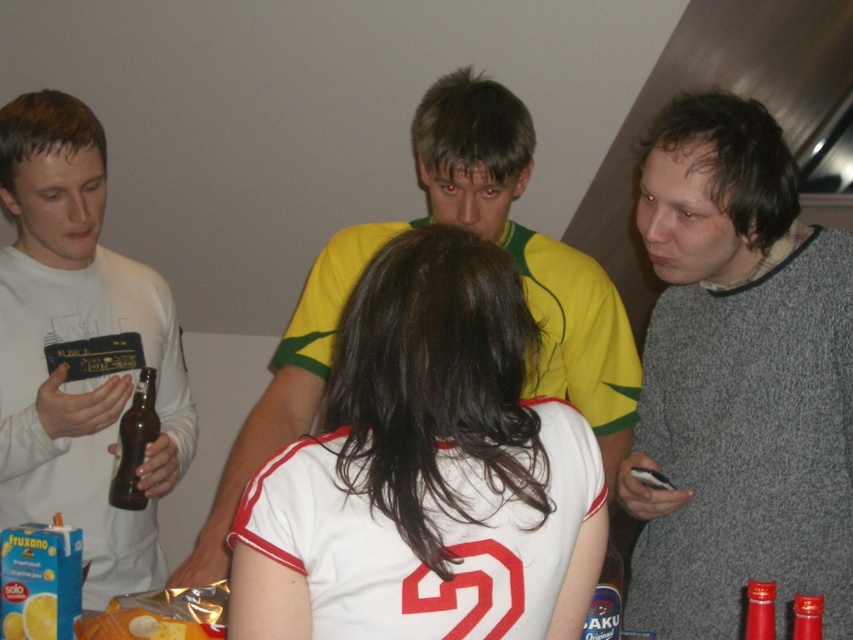
Question: Which of the following is the farthest from the observer?

Choices:
 (A) gray wool sweater at right
 (B) brown glass bottle at center

Answer: (B)

Question: Can you confirm if gray wool sweater at right is bigger than metallic silver bottle at lower right?

Choices:
 (A) no
 (B) yes

Answer: (B)

Question: Considering the real-world distances, which object is farthest from the red glass bottle at lower right?

Choices:
 (A) white matte shirt at left
 (B) gray wool sweater at right
 (C) brown glass bottle at center

Answer: (A)

Question: Can you confirm if brown glass bottle at center is smaller than translucent plastic bottle at lower right?

Choices:
 (A) yes
 (B) no

Answer: (A)

Question: Which of these objects is positioned closest to the gray wool sweater at right?

Choices:
 (A) brown glass bottle at center
 (B) metallic silver bottle at lower right
 (C) translucent plastic bottle at lower right

Answer: (C)

Question: Is white matte shirt at left thinner than metallic silver bottle at lower right?

Choices:
 (A) no
 (B) yes

Answer: (A)